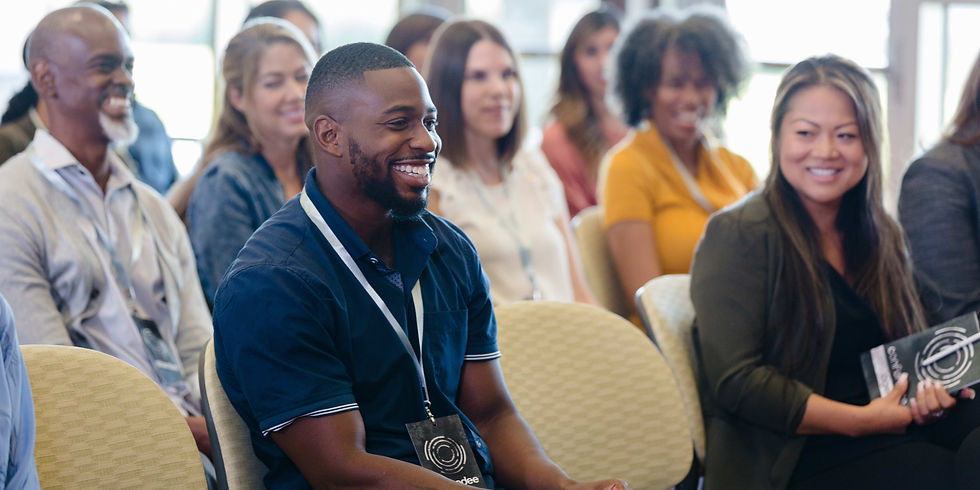
At what (x,y) coordinates should I click in order to perform the action: click on visible chairs. Please return your answer as a coordinate pair (x, y). Image resolution: width=980 pixels, height=490 pixels. Looking at the image, I should click on (130, 456), (222, 447), (539, 366), (680, 299), (598, 272).